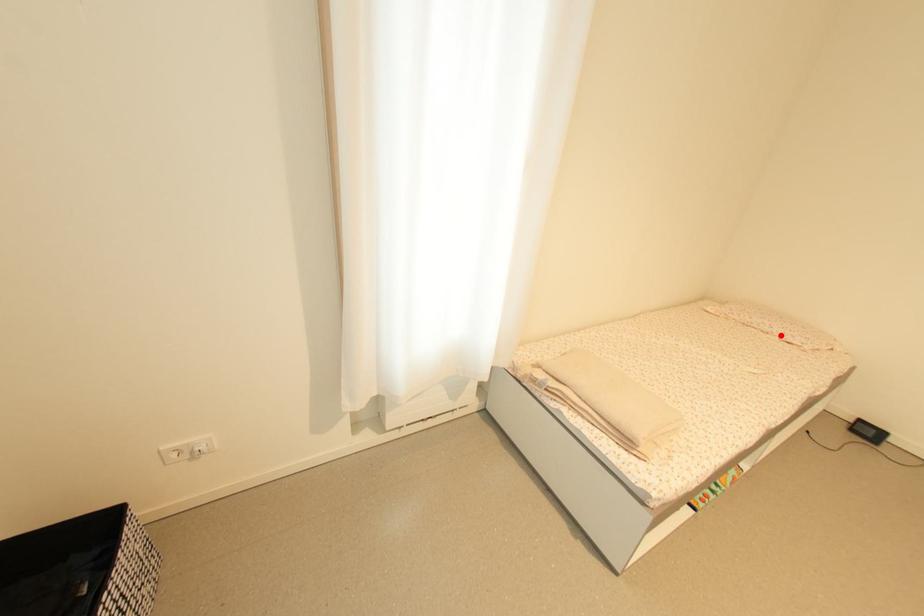
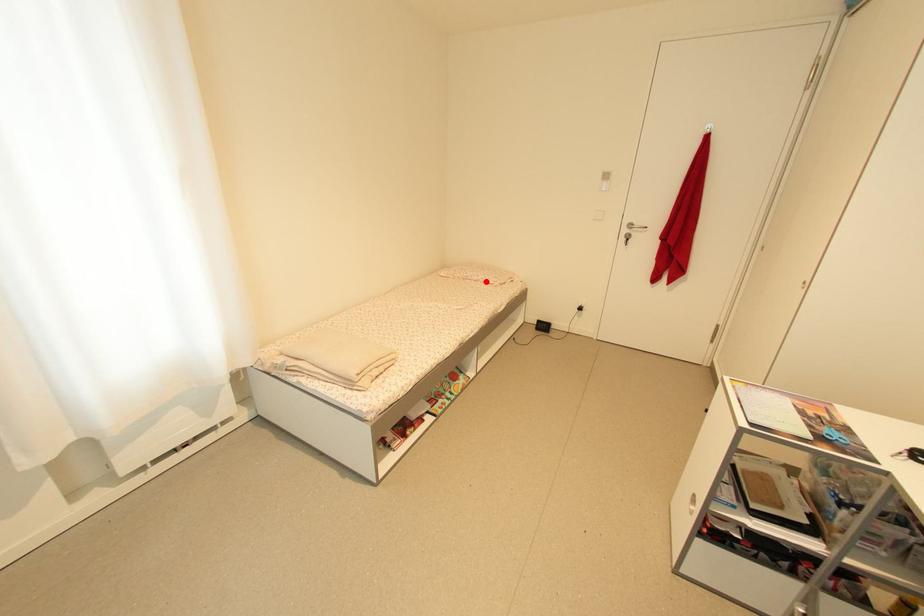
I am providing you with two images of the same scene from different viewpoints. A red point is marked on the first image and another point is marked on the second image. Are the points marked in image1 and image2 representing the same 3D position?

Yes